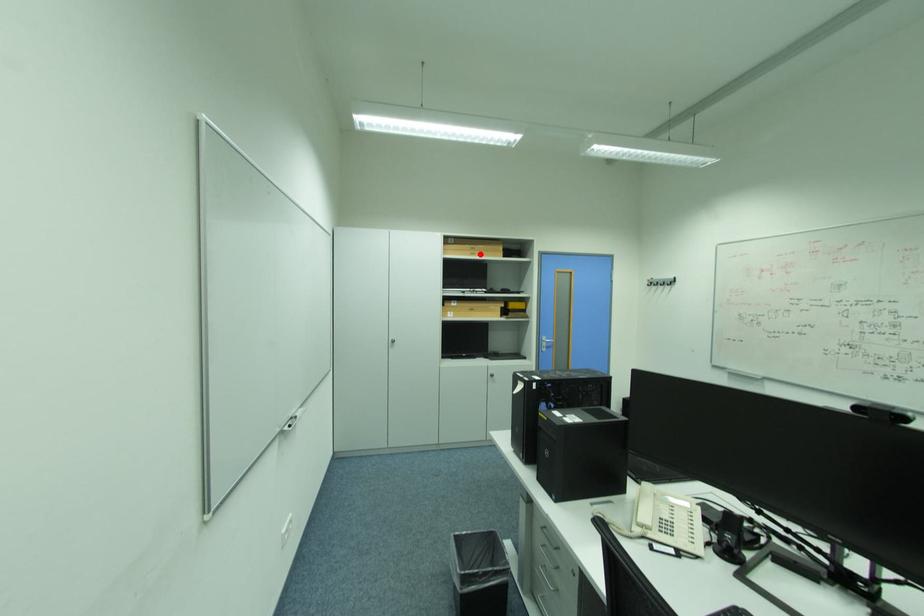
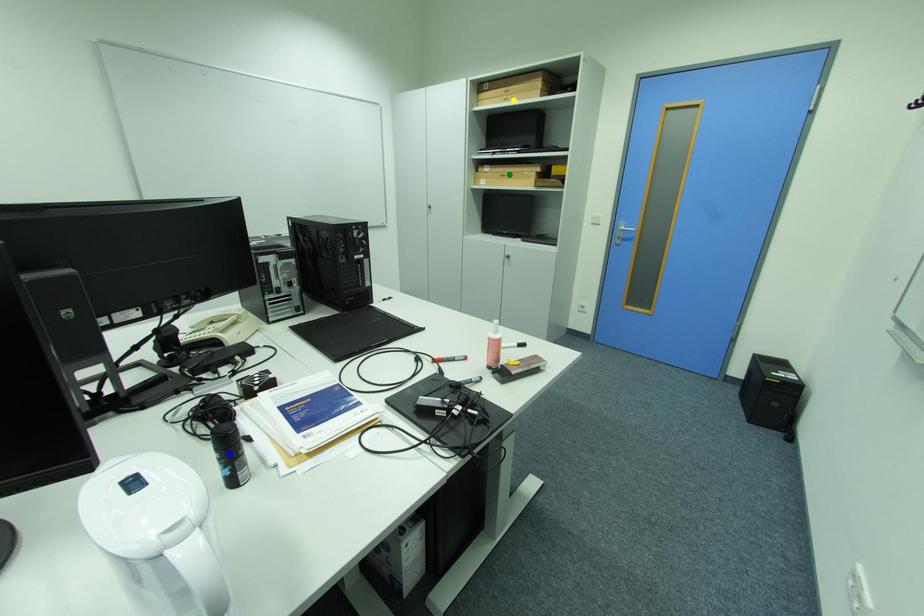
Question: I am providing you with two images of the same scene from different viewpoints. A red point is marked on the first image. You are given multiple points on the second image. Which spot in image 2 lines up with the point in image 1?

Choices:
 (A) yellow point
 (B) green point
 (C) blue point

Answer: (A)